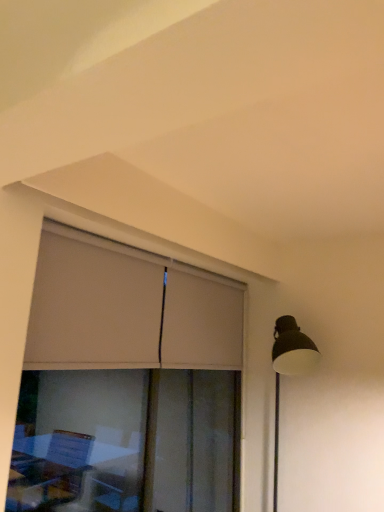
Question: Is matte beige window at center outside of beige fabric curtain at upper left?

Choices:
 (A) no
 (B) yes

Answer: (A)

Question: Considering the relative sizes of matte beige window at center and beige fabric curtain at upper left in the image provided, is matte beige window at center smaller than beige fabric curtain at upper left?

Choices:
 (A) yes
 (B) no

Answer: (B)

Question: Does matte beige window at center have a larger size compared to beige fabric curtain at upper left?

Choices:
 (A) no
 (B) yes

Answer: (B)

Question: Does matte beige window at center have a greater width compared to beige fabric curtain at upper left?

Choices:
 (A) no
 (B) yes

Answer: (A)

Question: From a real-world perspective, is matte beige window at center positioned over beige fabric curtain at upper left based on gravity?

Choices:
 (A) no
 (B) yes

Answer: (A)

Question: Is matte beige window at center further to camera compared to beige fabric curtain at upper left?

Choices:
 (A) yes
 (B) no

Answer: (B)

Question: From a real-world perspective, is beige fabric curtain at upper left under matte beige window at center?

Choices:
 (A) yes
 (B) no

Answer: (B)

Question: Is beige fabric curtain at upper left at the right side of matte beige window at center?

Choices:
 (A) no
 (B) yes

Answer: (B)

Question: Is beige fabric curtain at upper left smaller than matte beige window at center?

Choices:
 (A) no
 (B) yes

Answer: (B)

Question: Considering the relative sizes of beige fabric curtain at upper left and matte beige window at center in the image provided, is beige fabric curtain at upper left shorter than matte beige window at center?

Choices:
 (A) no
 (B) yes

Answer: (B)

Question: Is beige fabric curtain at upper left further to the viewer compared to matte beige window at center?

Choices:
 (A) yes
 (B) no

Answer: (A)

Question: Can you confirm if beige fabric curtain at upper left is bigger than matte beige window at center?

Choices:
 (A) no
 (B) yes

Answer: (A)

Question: Considering the positions of beige fabric curtain at upper left and matte beige window at center in the image, is beige fabric curtain at upper left taller or shorter than matte beige window at center?

Choices:
 (A) short
 (B) tall

Answer: (A)